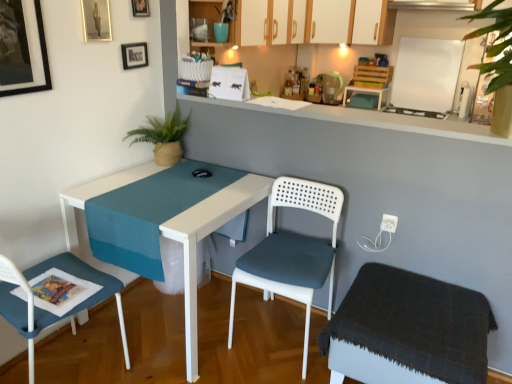
You are a GUI agent. You are given a task and a screenshot of the screen. Output one action in this format:
    pyautogui.click(x=<x>, y=<y>)
    Task: Click on the vacant space underneath white plastic table at center (from a real-world perspective)
    
    Given the screenshot: What is the action you would take?
    pyautogui.click(x=157, y=321)